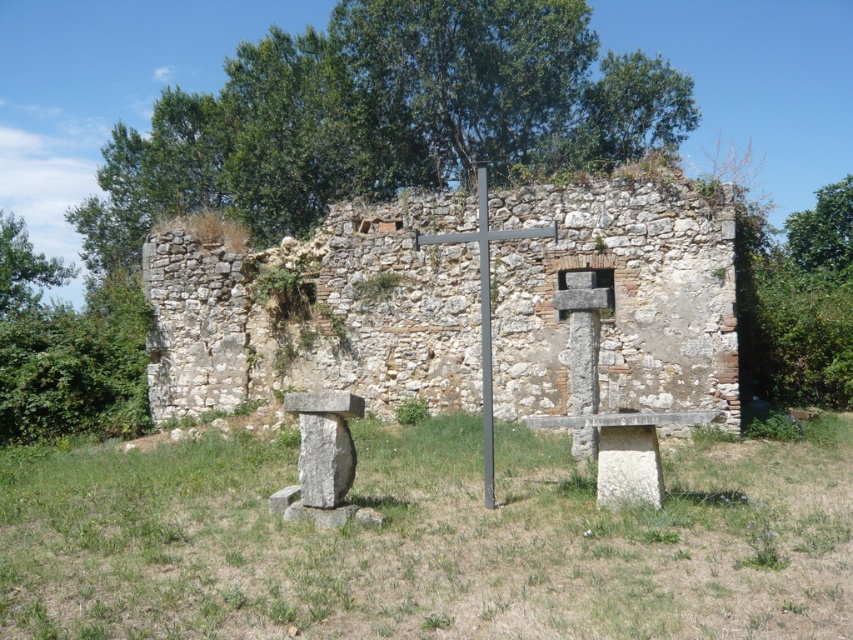
You are an archaeologist examining the image. You need to determine which object takes up more area in the image between the weathered stone ruins at center and the green leafy tree at upper left. Which one is it?

The green leafy tree at upper left takes up more area in the image than the weathered stone ruins at center because the weathered stone ruins at center occupies less space than green leafy tree at upper left.

You are standing at the origin point of the coordinate system. You want to walk to the weathered stone ruins at center. What are the coordinates you need to move to?

The coordinates you need to move to are approximately 0.477 on the x axis and 0.536 on the y axis.

You are a gardener who needs to water the green grass at center. You have a hose that can reach 10 meters. Is the green leafy tree at upper center within reach of your hose?

The distance between the green grass at center and the green leafy tree at upper center is 13.60 meters. Since the hose can only reach 10 meters, the green leafy tree at upper center is out of reach.